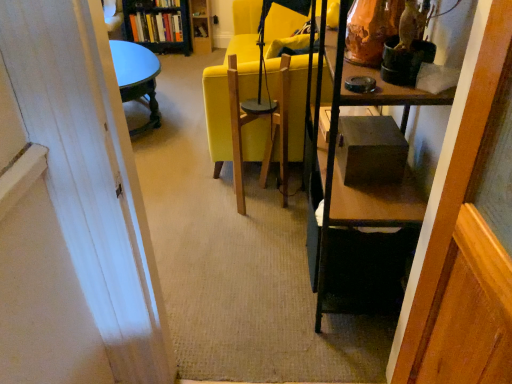
What do you see at coordinates (267, 133) in the screenshot? This screenshot has width=512, height=384. I see `wooden swivel chair at center` at bounding box center [267, 133].

This screenshot has width=512, height=384. In order to click on matte yellow chair at center in this screenshot , I will do `click(227, 80)`.

In order to face hardcover book at upper center, the 1th book from the top, should I rotate leftwards or rightwards?

You should look left and rotate roughly 11.306 degrees.

Identify the location of wooden swivel chair at center. click(x=267, y=133).

Is hardcover book at upper center, arranged as the second book when ordered from the bottom, bigger or smaller than hardcover books at upper left, the first book when ordered from bottom to top?

In the image, hardcover book at upper center, arranged as the second book when ordered from the bottom, appears to be smaller than hardcover books at upper left, the first book when ordered from bottom to top.

At what (x,y) coordinates should I click in order to perform the action: click on book that is above the hardcover books at upper left, the first book when ordered from bottom to top (from the image's perspective). Please return your answer as a coordinate pair (x, y). Looking at the image, I should click on (167, 3).

Are hardcover book at upper center, arranged as the second book when ordered from the bottom, and hardcover books at upper left, which is the second book in top-to-bottom order, making contact?

No, hardcover book at upper center, arranged as the second book when ordered from the bottom, is not with hardcover books at upper left, which is the second book in top-to-bottom order.

In terms of width, does matte yellow chair at center look wider or thinner when compared to hardcover book at upper center, arranged as the second book when ordered from the bottom?

Clearly, matte yellow chair at center has more width compared to hardcover book at upper center, arranged as the second book when ordered from the bottom.

Is matte yellow chair at center located outside hardcover book at upper center, the 1th book from the top?

Absolutely, matte yellow chair at center is external to hardcover book at upper center, the 1th book from the top.

What's the angular difference between matte yellow chair at center and hardcover book at upper center, arranged as the second book when ordered from the bottom,'s facing directions?

89.7 degrees separate the facing orientations of matte yellow chair at center and hardcover book at upper center, arranged as the second book when ordered from the bottom.

From the image's perspective, is matte yellow chair at center located above or below hardcover book at upper center, the 1th book from the top?

matte yellow chair at center is below hardcover book at upper center, the 1th book from the top.

Is hardcover book at upper center, the 1th book from the top, positioned far away from matte yellow chair at center?

Yes, hardcover book at upper center, the 1th book from the top, and matte yellow chair at center are quite far apart.

Considering the sizes of objects hardcover book at upper center, arranged as the second book when ordered from the bottom, and matte yellow chair at center in the image provided, who is smaller, hardcover book at upper center, arranged as the second book when ordered from the bottom, or matte yellow chair at center?

hardcover book at upper center, arranged as the second book when ordered from the bottom, is smaller.

Considering the relative sizes of hardcover book at upper center, arranged as the second book when ordered from the bottom, and matte yellow chair at center in the image provided, is hardcover book at upper center, arranged as the second book when ordered from the bottom, taller than matte yellow chair at center?

No.

Does hardcover book at upper center, arranged as the second book when ordered from the bottom, have a greater width compared to matte yellow chair at center?

Incorrect, the width of hardcover book at upper center, arranged as the second book when ordered from the bottom, does not surpass that of matte yellow chair at center.

Relative to wooden swivel chair at center, is matte yellow chair at center in front or behind?

In the image, matte yellow chair at center appears behind wooden swivel chair at center.

Find the location of `swivel chair below the matte yellow chair at center (from the image's perspective)`. swivel chair below the matte yellow chair at center (from the image's perspective) is located at coordinates (267, 133).

Considering the sizes of matte yellow chair at center and wooden swivel chair at center in the image, is matte yellow chair at center taller or shorter than wooden swivel chair at center?

Clearly, matte yellow chair at center is taller compared to wooden swivel chair at center.

Which object is positioned more to the left, matte yellow chair at center or wooden swivel chair at center?

Positioned to the left is wooden swivel chair at center.

Could you measure the distance between hardcover book at upper center, arranged as the second book when ordered from the bottom, and wooden swivel chair at center?

The distance of hardcover book at upper center, arranged as the second book when ordered from the bottom, from wooden swivel chair at center is 9.67 feet.

Does hardcover book at upper center, arranged as the second book when ordered from the bottom, have a lesser height compared to wooden swivel chair at center?

Yes, hardcover book at upper center, arranged as the second book when ordered from the bottom, is shorter than wooden swivel chair at center.

Is hardcover book at upper center, the 1th book from the top, positioned beyond the bounds of wooden swivel chair at center?

Yes, hardcover book at upper center, the 1th book from the top, is not within wooden swivel chair at center.

Is the position of hardcover book at upper center, arranged as the second book when ordered from the bottom, more distant than that of wooden swivel chair at center?

Yes, the depth of hardcover book at upper center, arranged as the second book when ordered from the bottom, is greater than that of wooden swivel chair at center.

Locate an element on the screen. The image size is (512, 384). swivel chair located above the hardcover books at upper left, which is the second book in top-to-bottom order (from a real-world perspective) is located at coordinates point(267,133).

Is wooden swivel chair at center at the back of hardcover books at upper left, the first book when ordered from bottom to top?

That's not correct — hardcover books at upper left, the first book when ordered from bottom to top, is not looking away from wooden swivel chair at center.

Is hardcover books at upper left, the first book when ordered from bottom to top, positioned far away from wooden swivel chair at center?

hardcover books at upper left, the first book when ordered from bottom to top, is far away from wooden swivel chair at center.

From the image's perspective, which one is positioned higher, hardcover books at upper left, which is the second book in top-to-bottom order, or wooden swivel chair at center?

From the image's view, hardcover books at upper left, which is the second book in top-to-bottom order, is above.

Which of these two, wooden swivel chair at center or hardcover book at upper center, arranged as the second book when ordered from the bottom, stands taller?

wooden swivel chair at center is taller.

Looking at this image, can hardcover book at upper center, arranged as the second book when ordered from the bottom, be found inside wooden swivel chair at center?

Definitely not — hardcover book at upper center, arranged as the second book when ordered from the bottom, is not inside wooden swivel chair at center.

Consider the image. Is wooden swivel chair at center facing towards hardcover book at upper center, arranged as the second book when ordered from the bottom?

No, wooden swivel chair at center is not turned towards hardcover book at upper center, arranged as the second book when ordered from the bottom.

Identify the location of book in front of the hardcover books at upper left, the first book when ordered from bottom to top. The height and width of the screenshot is (384, 512). (167, 3).

This screenshot has height=384, width=512. What are the coordinates of `the 2nd book above the matte yellow chair at center (from the image's perspective)` in the screenshot? It's located at (167, 3).

Looking at this image, when comparing their distances from wooden swivel chair at center, does matte yellow chair at center or hardcover books at upper left, which is the second book in top-to-bottom order, seem further?

hardcover books at upper left, which is the second book in top-to-bottom order, is further to wooden swivel chair at center.

Estimate the real-world distances between objects in this image. Which object is closer to hardcover book at upper center, the 1th book from the top, wooden swivel chair at center or hardcover books at upper left, the first book when ordered from bottom to top?

hardcover books at upper left, the first book when ordered from bottom to top, is closer to hardcover book at upper center, the 1th book from the top.

When comparing their distances from wooden swivel chair at center, does hardcover book at upper center, arranged as the second book when ordered from the bottom, or hardcover books at upper left, which is the second book in top-to-bottom order, seem closer?

Among the two, hardcover books at upper left, which is the second book in top-to-bottom order, is located nearer to wooden swivel chair at center.

When comparing their distances from hardcover book at upper center, the 1th book from the top, does hardcover books at upper left, which is the second book in top-to-bottom order, or wooden swivel chair at center seem closer?

hardcover books at upper left, which is the second book in top-to-bottom order.

When comparing their distances from hardcover books at upper left, which is the second book in top-to-bottom order, does wooden swivel chair at center or matte yellow chair at center seem further?

wooden swivel chair at center is positioned further to the anchor hardcover books at upper left, which is the second book in top-to-bottom order.

From the picture: From the image, which object appears to be farther from matte yellow chair at center, hardcover books at upper left, the first book when ordered from bottom to top, or hardcover book at upper center, arranged as the second book when ordered from the bottom?

hardcover book at upper center, arranged as the second book when ordered from the bottom, is further to matte yellow chair at center.

When comparing their distances from matte yellow chair at center, does hardcover books at upper left, the first book when ordered from bottom to top, or wooden swivel chair at center seem further?

hardcover books at upper left, the first book when ordered from bottom to top, lies further to matte yellow chair at center than the other object.

Considering their positions, is matte yellow chair at center positioned closer to hardcover book at upper center, the 1th book from the top, than wooden swivel chair at center?

matte yellow chair at center is closer to hardcover book at upper center, the 1th book from the top.

Locate an element on the screen. chair between wooden swivel chair at center and hardcover books at upper left, the first book when ordered from bottom to top, along the z-axis is located at coordinates (227, 80).

Locate an element on the screen. book between wooden swivel chair at center and hardcover books at upper left, which is the second book in top-to-bottom order, in the front-back direction is located at coordinates (167, 3).

Find the location of a particular element. This screenshot has width=512, height=384. chair between wooden swivel chair at center and hardcover book at upper center, the 1th book from the top, in the front-back direction is located at coordinates (227, 80).

This screenshot has height=384, width=512. I want to click on book located between matte yellow chair at center and hardcover books at upper left, which is the second book in top-to-bottom order, in the depth direction, so click(167, 3).